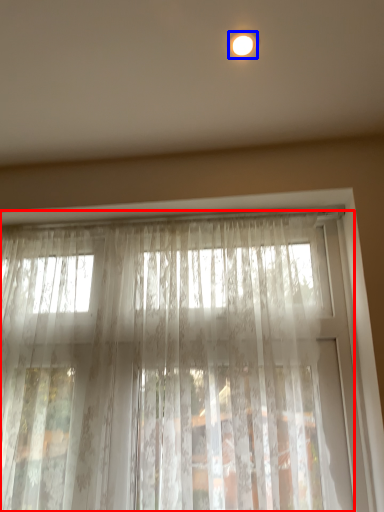
Question: Which point is closer to the camera, curtain (highlighted by a red box) or lighting (highlighted by a blue box)?

Choices:
 (A) curtain
 (B) lighting

Answer: (B)